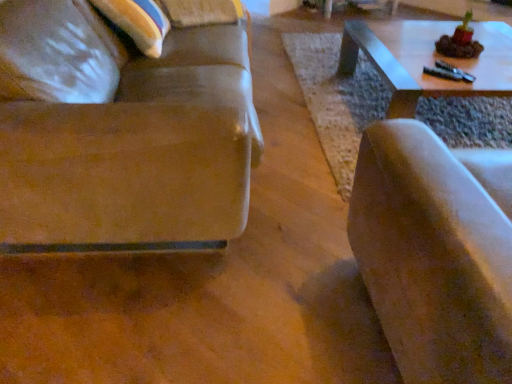
Question: Is suede-like beige chair at right beside suede-like brown couch at left?

Choices:
 (A) yes
 (B) no

Answer: (B)

Question: From the image's perspective, is suede-like beige chair at right above suede-like brown couch at left?

Choices:
 (A) no
 (B) yes

Answer: (A)

Question: Does suede-like beige chair at right have a lesser height compared to suede-like brown couch at left?

Choices:
 (A) no
 (B) yes

Answer: (B)

Question: Considering the relative positions of suede-like beige chair at right and suede-like brown couch at left in the image provided, is suede-like beige chair at right to the right of suede-like brown couch at left from the viewer's perspective?

Choices:
 (A) no
 (B) yes

Answer: (B)

Question: Can you confirm if suede-like beige chair at right is thinner than suede-like brown couch at left?

Choices:
 (A) yes
 (B) no

Answer: (A)

Question: Is suede-like brown couch at left at the back of suede-like beige chair at right?

Choices:
 (A) no
 (B) yes

Answer: (A)

Question: Is suede-like brown couch at left to the left of suede-like beige chair at right from the viewer's perspective?

Choices:
 (A) no
 (B) yes

Answer: (B)

Question: Is suede-like brown couch at left at the right side of suede-like beige chair at right?

Choices:
 (A) yes
 (B) no

Answer: (B)

Question: Does suede-like brown couch at left lie in front of suede-like beige chair at right?

Choices:
 (A) yes
 (B) no

Answer: (B)

Question: Is suede-like brown couch at left bigger than suede-like beige chair at right?

Choices:
 (A) yes
 (B) no

Answer: (A)

Question: Is suede-like brown couch at left far from suede-like beige chair at right?

Choices:
 (A) no
 (B) yes

Answer: (A)

Question: Is suede-like brown couch at left outside suede-like beige chair at right?

Choices:
 (A) yes
 (B) no

Answer: (A)

Question: In terms of height, does suede-like beige chair at right look taller or shorter compared to suede-like brown couch at left?

Choices:
 (A) short
 (B) tall

Answer: (A)